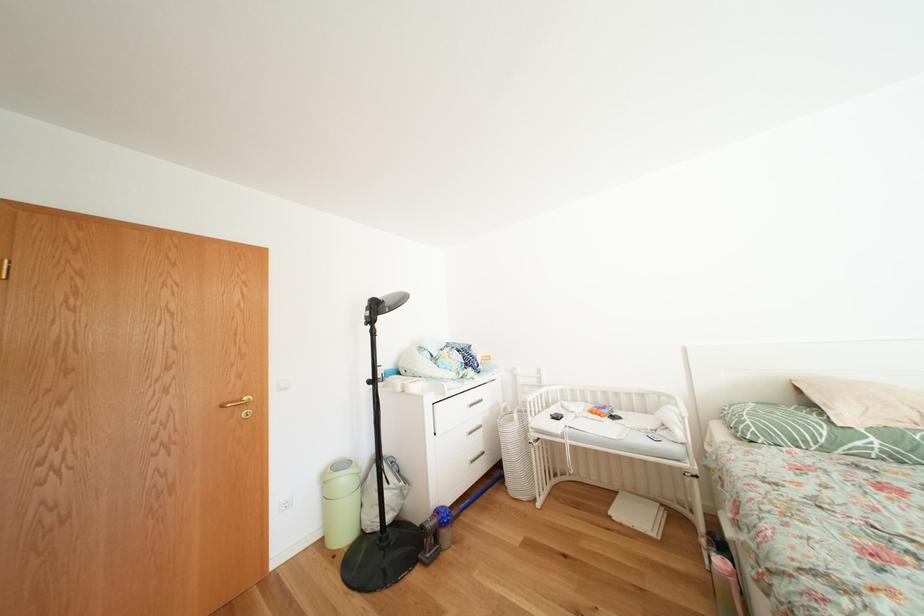
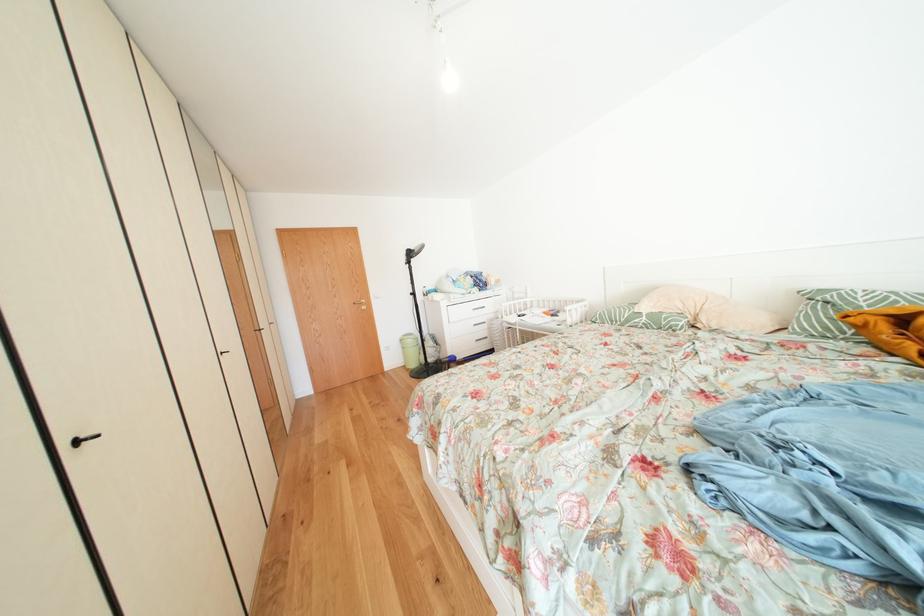
Which direction would the cameraman need to move to produce the second image?

The cameraman walked toward right, backward.